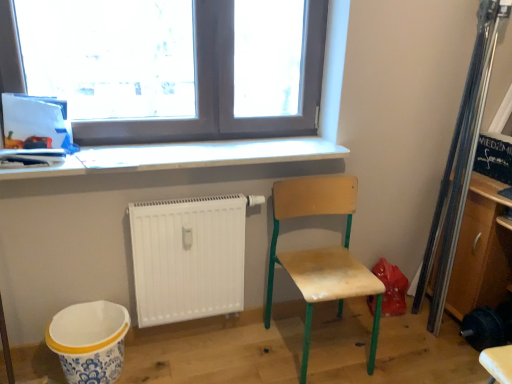
Question: Visually, is wooden cabinet at right positioned to the left or to the right of white matte radiator at lower center?

Choices:
 (A) left
 (B) right

Answer: (B)

Question: Is wooden cabinet at right in front of or behind white matte radiator at lower center in the image?

Choices:
 (A) behind
 (B) front

Answer: (B)

Question: Based on their relative distances, which object is nearer to the wooden cabinet at right?

Choices:
 (A) white ceramic mixing bowl at lower left
 (B) transparent glass window at upper center
 (C) white glossy counter top at upper center
 (D) wooden chair at lower right
 (E) white matte radiator at lower center

Answer: (D)

Question: Which object is positioned farthest from the wooden chair at lower right?

Choices:
 (A) white glossy counter top at upper center
 (B) wooden cabinet at right
 (C) transparent glass window at upper center
 (D) white ceramic mixing bowl at lower left
 (E) white matte radiator at lower center

Answer: (D)